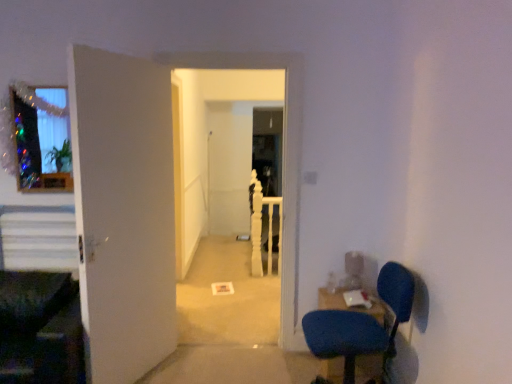
Locate an element on the screen. The image size is (512, 384). free location in front of white matte carpet at center is located at coordinates (220, 361).